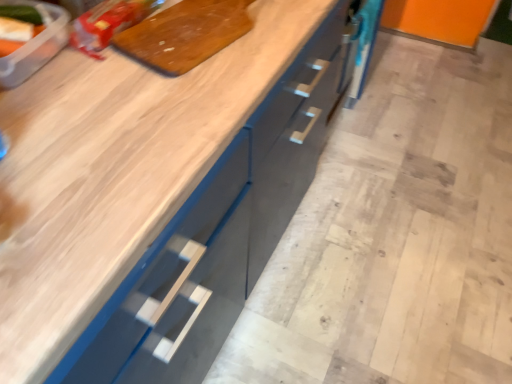
At what (x,y) coordinates should I click in order to perform the action: click on vacant location below wooden cutting board at upper center (from a real-world perspective). Please return your answer as a coordinate pair (x, y). This screenshot has width=512, height=384. Looking at the image, I should click on (206, 24).